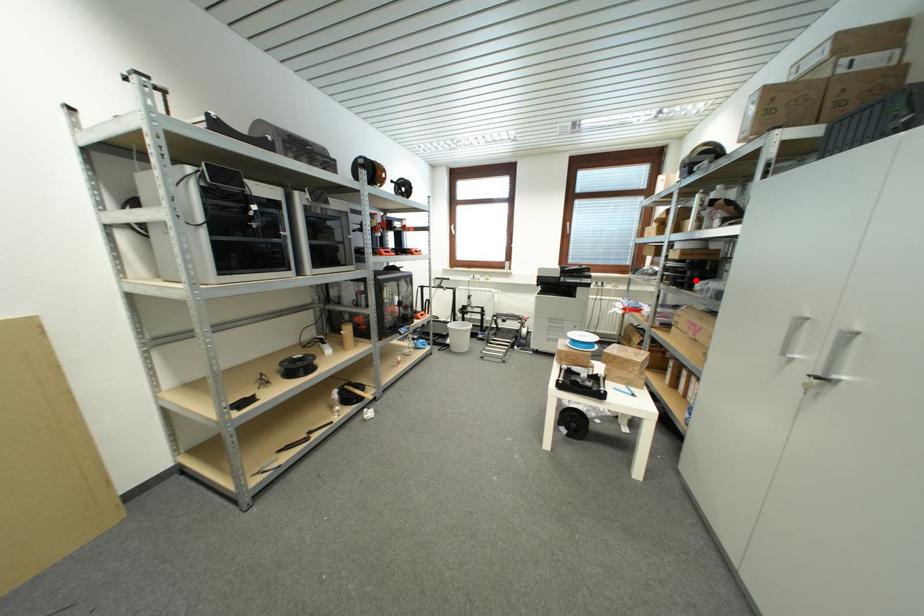
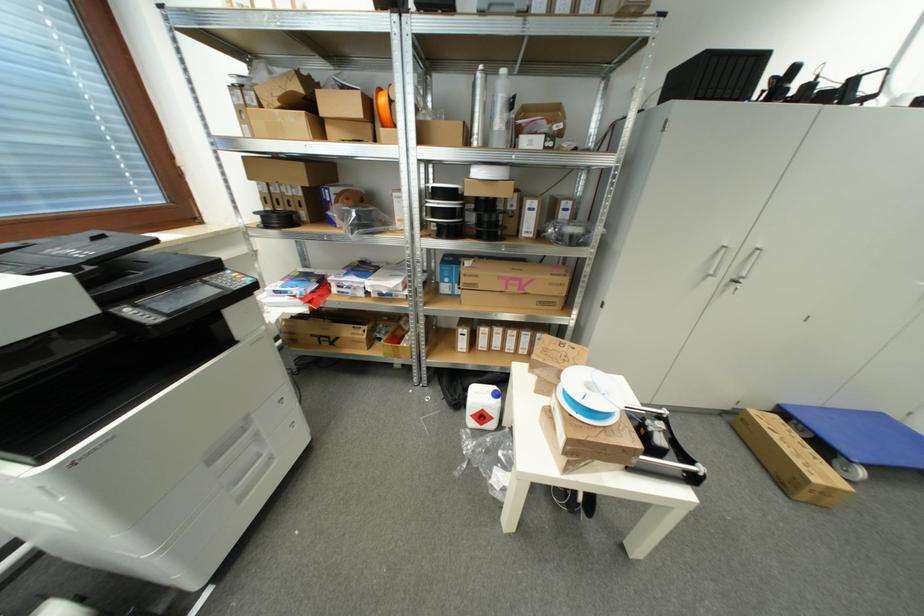
Where in the second image is the point corresponding to the highlighted location from the first image?

(493, 225)